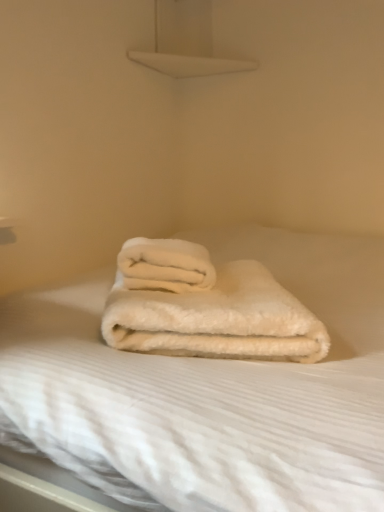
Question: Is white fluffy towel at center, the 2th towel positioned from the top, to the right of white fluffy blanket at center from the viewer's perspective?

Choices:
 (A) no
 (B) yes

Answer: (A)

Question: Can you confirm if white fluffy towel at center, the 2th towel positioned from the top, is shorter than white fluffy blanket at center?

Choices:
 (A) yes
 (B) no

Answer: (A)

Question: Would you say white fluffy towel at center, which is counted as the 1th towel, starting from the bottom, is outside white fluffy blanket at center?

Choices:
 (A) no
 (B) yes

Answer: (A)

Question: Is white fluffy towel at center, which is counted as the 1th towel, starting from the bottom, positioned behind white fluffy blanket at center?

Choices:
 (A) no
 (B) yes

Answer: (B)

Question: Could you tell me if white fluffy towel at center, the 2th towel positioned from the top, is facing white fluffy blanket at center?

Choices:
 (A) no
 (B) yes

Answer: (B)

Question: Looking at their shapes, would you say white fluffy blanket at center is wider or thinner than white fluffy towel at center, the 2th towel positioned from the bottom?

Choices:
 (A) wide
 (B) thin

Answer: (A)

Question: In terms of height, does white fluffy blanket at center look taller or shorter compared to white fluffy towel at center, which is counted as the 1th towel, starting from the top?

Choices:
 (A) short
 (B) tall

Answer: (B)

Question: Considering the positions of white fluffy blanket at center and white fluffy towel at center, which is counted as the 1th towel, starting from the top, in the image, is white fluffy blanket at center bigger or smaller than white fluffy towel at center, which is counted as the 1th towel, starting from the top,?

Choices:
 (A) big
 (B) small

Answer: (A)

Question: In the image, is white fluffy blanket at center positioned in front of or behind white fluffy towel at center, the 2th towel positioned from the bottom?

Choices:
 (A) behind
 (B) front

Answer: (B)

Question: Considering the positions of white fluffy towel at center, the 2th towel positioned from the top, and white fluffy blanket at center in the image, is white fluffy towel at center, the 2th towel positioned from the top, wider or thinner than white fluffy blanket at center?

Choices:
 (A) thin
 (B) wide

Answer: (A)

Question: Is white fluffy towel at center, the 2th towel positioned from the top, in front of or behind white fluffy blanket at center in the image?

Choices:
 (A) front
 (B) behind

Answer: (B)

Question: From their relative heights in the image, would you say white fluffy towel at center, which is counted as the 1th towel, starting from the bottom, is taller or shorter than white fluffy blanket at center?

Choices:
 (A) tall
 (B) short

Answer: (B)

Question: Is point (226, 328) closer or farther from the camera than point (24, 330)?

Choices:
 (A) farther
 (B) closer

Answer: (A)

Question: Considering the positions of point (180, 309) and point (195, 250), is point (180, 309) closer or farther from the camera than point (195, 250)?

Choices:
 (A) closer
 (B) farther

Answer: (A)

Question: Which is correct: white fluffy towel at center, which is counted as the 1th towel, starting from the bottom, is inside white fluffy towel at center, which is counted as the 1th towel, starting from the top, or outside of it?

Choices:
 (A) outside
 (B) inside

Answer: (A)